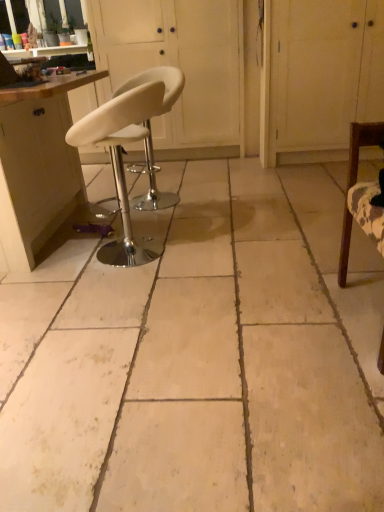
Find the location of a particular element. The height and width of the screenshot is (512, 384). free space to the right of white leather stool at center, the 3th chair positioned from the right is located at coordinates (216, 246).